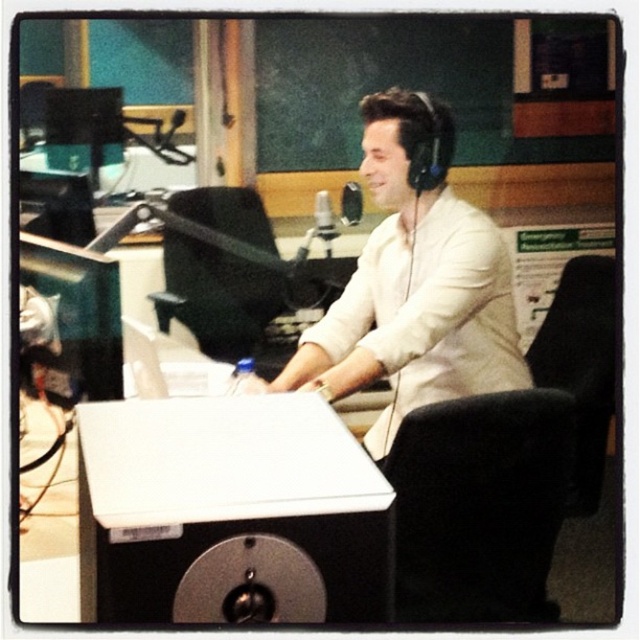
Does black leather swivel chair at center have a smaller size compared to black fabric swivel chair at right?

No, black leather swivel chair at center is not smaller than black fabric swivel chair at right.

Which is behind, point (408, 493) or point (566, 317)?

Point (566, 317)

Where is `black leather swivel chair at center`? The width and height of the screenshot is (640, 640). black leather swivel chair at center is located at coordinates (480, 506).

In the scene shown: Can you confirm if white plastic table at center is positioned below black leather chair at center?

Yes.

The height and width of the screenshot is (640, 640). Find the location of `white plastic table at center`. white plastic table at center is located at coordinates (230, 513).

The image size is (640, 640). I want to click on black leather chair at center, so click(x=216, y=296).

Is black leather chair at center below black fabric swivel chair at right?

Incorrect, black leather chair at center is not positioned below black fabric swivel chair at right.

Describe the element at coordinates (216, 296) in the screenshot. I see `black leather chair at center` at that location.

Locate an element on the screen. black leather chair at center is located at coordinates (216, 296).